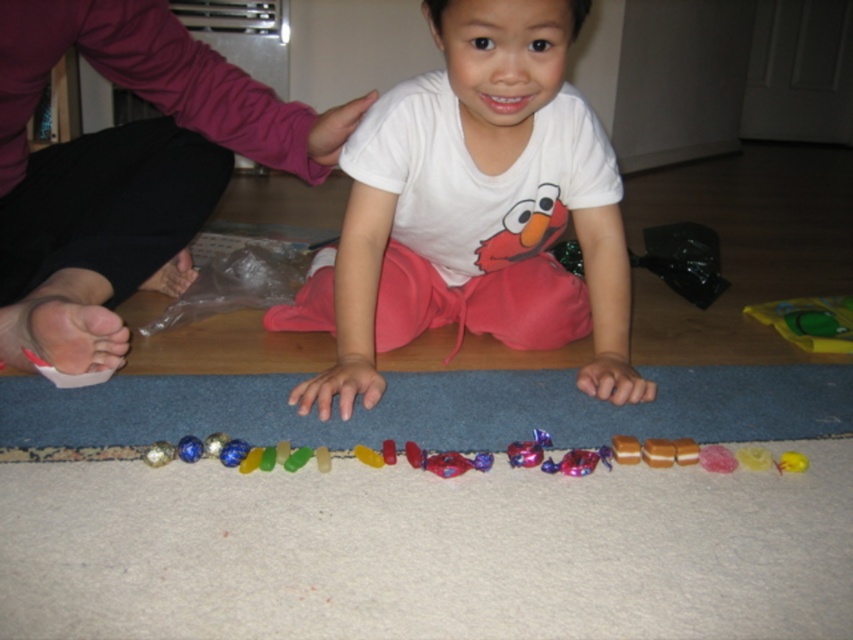
Can you confirm if pink fabric at upper center is shorter than translucent yellow candy at center?

No.

Is point (73, 29) positioned before point (788, 456)?

No.

Locate an element on the screen. pink fabric at upper center is located at coordinates (125, 170).

Which is more to the left, glossy plastic candy at center or translucent yellow candy at center?

Positioned to the left is glossy plastic candy at center.

Measure the distance between glossy plastic candy at center and translucent yellow candy at center.

The distance of glossy plastic candy at center from translucent yellow candy at center is 14.41 inches.

Between point (676, 452) and point (793, 452), which one is positioned in front?

Point (676, 452) is in front.

Locate an element on the screen. glossy plastic candy at center is located at coordinates (636, 456).

Is white cotton toddler at center to the right of glossy plastic candy at center from the viewer's perspective?

Yes, white cotton toddler at center is to the right of glossy plastic candy at center.

Between white cotton toddler at center and glossy plastic candy at center, which one has less height?

glossy plastic candy at center is shorter.

Who is more distant from viewer, (405,278) or (222,449)?

The point (405,278) is behind.

Locate an element on the screen. Image resolution: width=853 pixels, height=640 pixels. white cotton toddler at center is located at coordinates pyautogui.click(x=474, y=209).